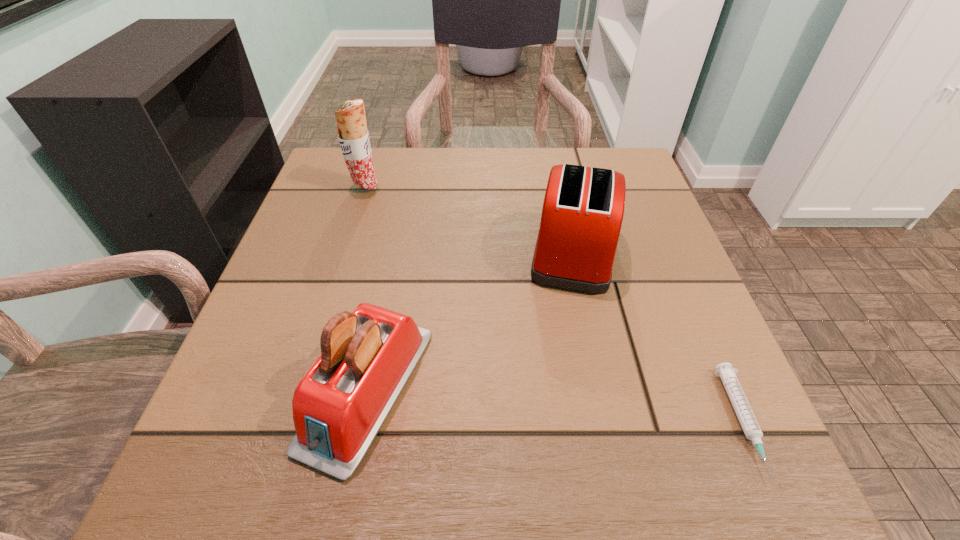
This screenshot has width=960, height=540. Find the location of `object that is at the far edge`. object that is at the far edge is located at coordinates point(353,136).

I want to click on toaster at the near edge, so point(367,356).

Find the location of a particular element. The width and height of the screenshot is (960, 540). syringe that is at the near edge is located at coordinates (x=749, y=424).

Where is `burrito located at the left edge`? This screenshot has height=540, width=960. burrito located at the left edge is located at coordinates pyautogui.click(x=353, y=136).

I want to click on toaster that is at the left edge, so click(367, 356).

At what (x,y) coordinates should I click in order to perform the action: click on toaster that is at the right edge. Please return your answer as a coordinate pair (x, y). Looking at the image, I should click on (583, 208).

The height and width of the screenshot is (540, 960). What are the coordinates of `syringe located in the right edge section of the desktop` in the screenshot? It's located at (x=749, y=424).

Image resolution: width=960 pixels, height=540 pixels. I want to click on object positioned at the far left corner, so click(353, 136).

Locate an element on the screen. object that is at the near left corner is located at coordinates (367, 356).

The width and height of the screenshot is (960, 540). Find the location of `object that is at the near right corner`. object that is at the near right corner is located at coordinates pyautogui.click(x=749, y=424).